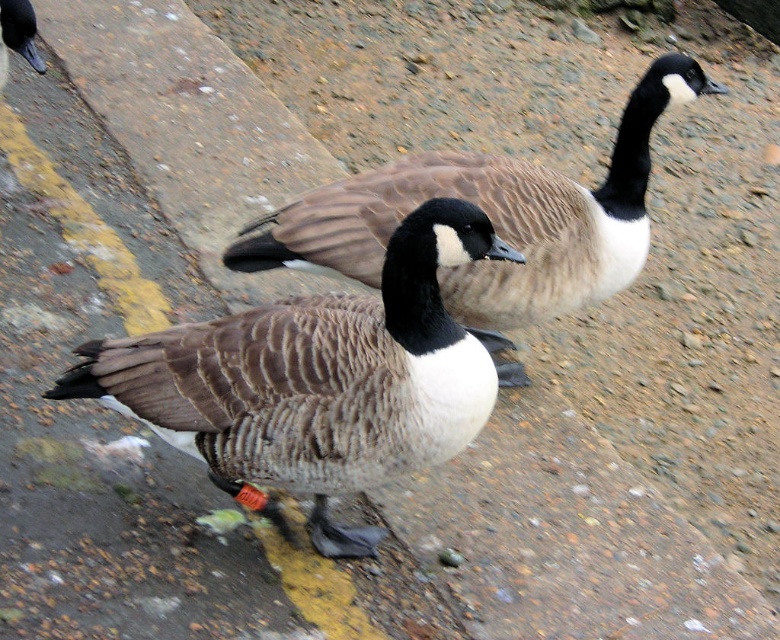
You are a wildlife researcher observing the gravelly area. You notice a brown textured goose at center and a brown feathered duck at upper left. Which bird is located to the right of the other?

The brown textured goose at center is positioned on the right side of brown feathered duck at upper left.

Based on the photo, you are a wildlife researcher observing two ducks in a gravel area. You need to determine which duck is wider. You see a brown textured duck at center and a brown feathered duck at upper left. Which one has a greater width?

The brown textured duck at center has a greater width than the brown feathered duck at upper left.

You are a wildlife photographer aiming to capture a clear shot of the brown textured goose at center and the brown feathered duck at upper left. Since you want both subjects in focus, which one should you focus on first to ensure the other remains sharp in the photo?

The brown textured goose at center is in front of the brown feathered duck at upper left. To ensure both are in focus, focus on the brown textured goose at center first as it is closer to the camera, and the duck will be in the background but still sharp if the depth of field is sufficient.